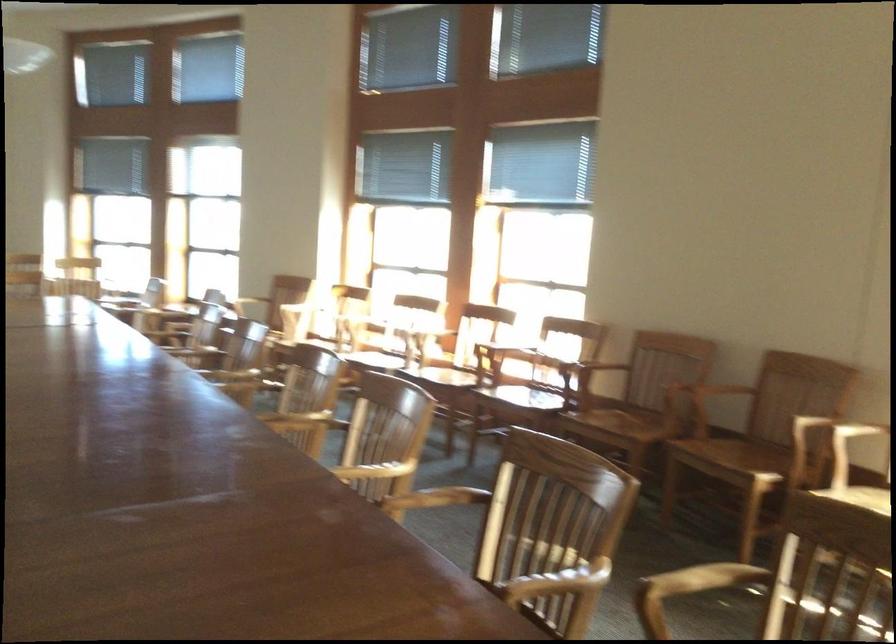
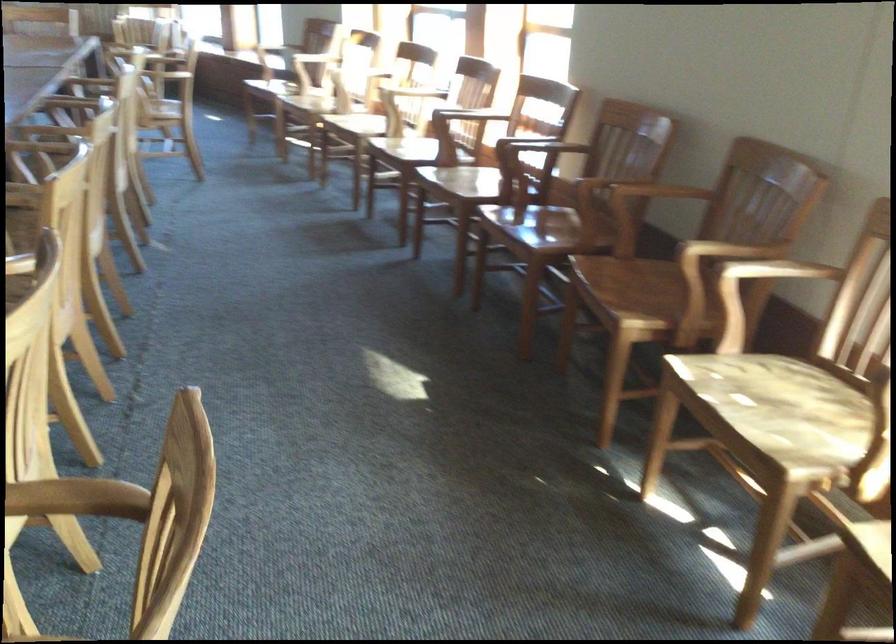
Where in the second image is the point corresponding to point 624,417 from the first image?

(531, 230)